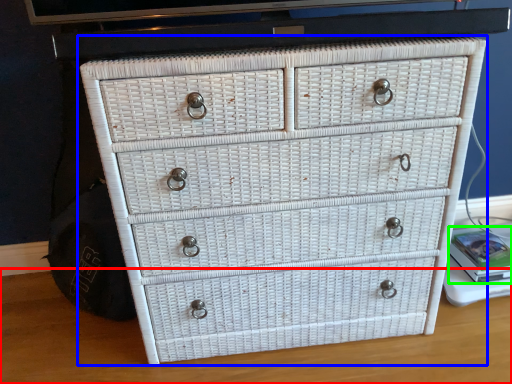
Question: Based on their relative distances, which object is farther from table top (highlighted by a red box)? Choose from chest of drawers (highlighted by a blue box) and book (highlighted by a green box).

Choices:
 (A) chest of drawers
 (B) book

Answer: (B)